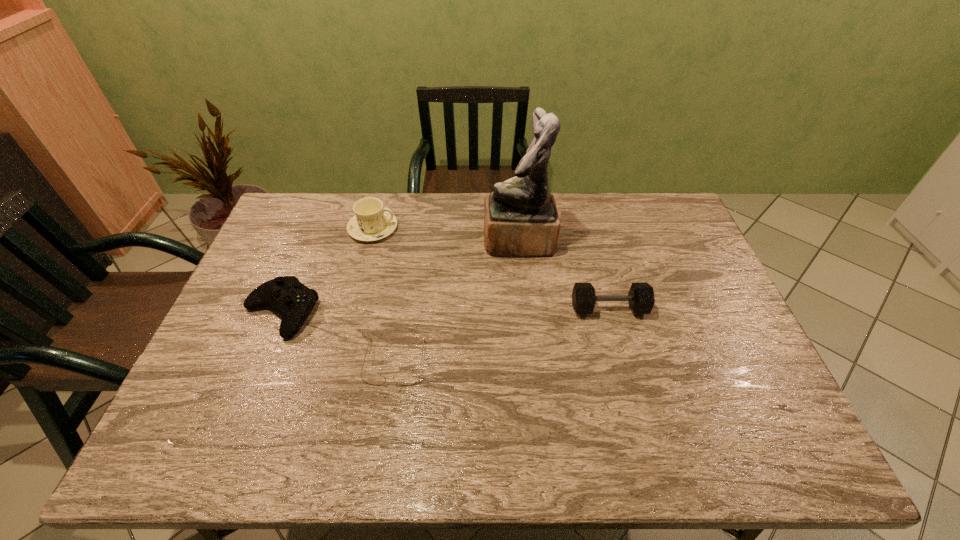
This screenshot has width=960, height=540. What are the coordinates of `vacant region at the right edge of the desktop` in the screenshot? It's located at (708, 381).

The height and width of the screenshot is (540, 960). I want to click on free region at the far left corner, so click(275, 232).

The width and height of the screenshot is (960, 540). In order to click on free spot at the far right corner of the desktop in this screenshot , I will do `click(662, 222)`.

Find the location of `free region at the near right corner`. free region at the near right corner is located at coordinates [791, 450].

Locate an element on the screen. This screenshot has height=540, width=960. free space between the chinaware and the fourth object from left to right is located at coordinates (445, 235).

You are a GUI agent. You are given a task and a screenshot of the screen. Output one action in this format:
    pyautogui.click(x=<x>, y=<y>)
    Task: Click on the free space between the sculpture and the dumbbell
    This screenshot has width=960, height=540.
    Given the screenshot: What is the action you would take?
    pyautogui.click(x=564, y=275)

You are a GUI agent. You are given a task and a screenshot of the screen. Output one action in this format:
    pyautogui.click(x=<x>, y=<y>)
    Task: Click on the empty space between the rightmost object and the shortest object
    The image size is (960, 540).
    Given the screenshot: What is the action you would take?
    pyautogui.click(x=502, y=335)

Locate an element on the screen. The height and width of the screenshot is (540, 960). free point between the second shortest object and the spectacles is located at coordinates (338, 337).

You are a GUI agent. You are given a task and a screenshot of the screen. Output one action in this format:
    pyautogui.click(x=<x>, y=<y>)
    Task: Click on the vacant area that lies between the chinaware and the tallest object
    The width and height of the screenshot is (960, 540).
    Given the screenshot: What is the action you would take?
    [x=445, y=235]

Locate an element on the screen. This screenshot has height=540, width=960. free space that is in between the sculpture and the fourth tallest object is located at coordinates (399, 276).